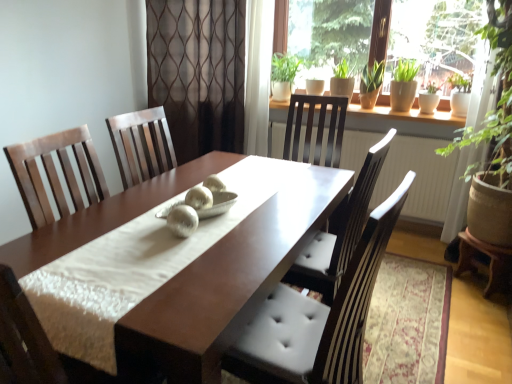
Question: Is matte white table at lower right, the 2th table from the left, outside shiny brown table at center, acting as the second table starting from the right?

Choices:
 (A) yes
 (B) no

Answer: (A)

Question: Is matte white table at lower right, the 2th table from the left, wider than shiny brown table at center, positioned as the 1th table in left-to-right order?

Choices:
 (A) yes
 (B) no

Answer: (B)

Question: Considering the relative sizes of matte white table at lower right, which is the 1th table in right-to-left order, and shiny brown table at center, positioned as the 1th table in left-to-right order, in the image provided, is matte white table at lower right, which is the 1th table in right-to-left order, taller than shiny brown table at center, positioned as the 1th table in left-to-right order,?

Choices:
 (A) yes
 (B) no

Answer: (B)

Question: Can you confirm if matte white table at lower right, which is the 1th table in right-to-left order, is shorter than shiny brown table at center, acting as the second table starting from the right?

Choices:
 (A) yes
 (B) no

Answer: (A)

Question: Does matte white table at lower right, which is the 1th table in right-to-left order, appear on the right side of shiny brown table at center, acting as the second table starting from the right?

Choices:
 (A) no
 (B) yes

Answer: (B)

Question: Is the depth of matte white table at lower right, the 2th table from the left, less than that of shiny brown table at center, positioned as the 1th table in left-to-right order?

Choices:
 (A) yes
 (B) no

Answer: (B)

Question: From a real-world perspective, does shiny brown table at center, positioned as the 1th table in left-to-right order, sit lower than brown sheer curtain at center?

Choices:
 (A) no
 (B) yes

Answer: (B)

Question: Does shiny brown table at center, positioned as the 1th table in left-to-right order, turn towards brown sheer curtain at center?

Choices:
 (A) yes
 (B) no

Answer: (B)

Question: Is shiny brown table at center, acting as the second table starting from the right, at the left side of brown sheer curtain at center?

Choices:
 (A) no
 (B) yes

Answer: (A)

Question: From the image's perspective, does shiny brown table at center, positioned as the 1th table in left-to-right order, appear higher than brown sheer curtain at center?

Choices:
 (A) no
 (B) yes

Answer: (A)

Question: From a real-world perspective, is shiny brown table at center, positioned as the 1th table in left-to-right order, on brown sheer curtain at center?

Choices:
 (A) no
 (B) yes

Answer: (A)

Question: Is brown sheer curtain at center completely or partially inside shiny brown table at center, positioned as the 1th table in left-to-right order?

Choices:
 (A) yes
 (B) no

Answer: (B)

Question: Is white glossy radiator at upper center positioned behind brown sheer curtain at center?

Choices:
 (A) no
 (B) yes

Answer: (A)